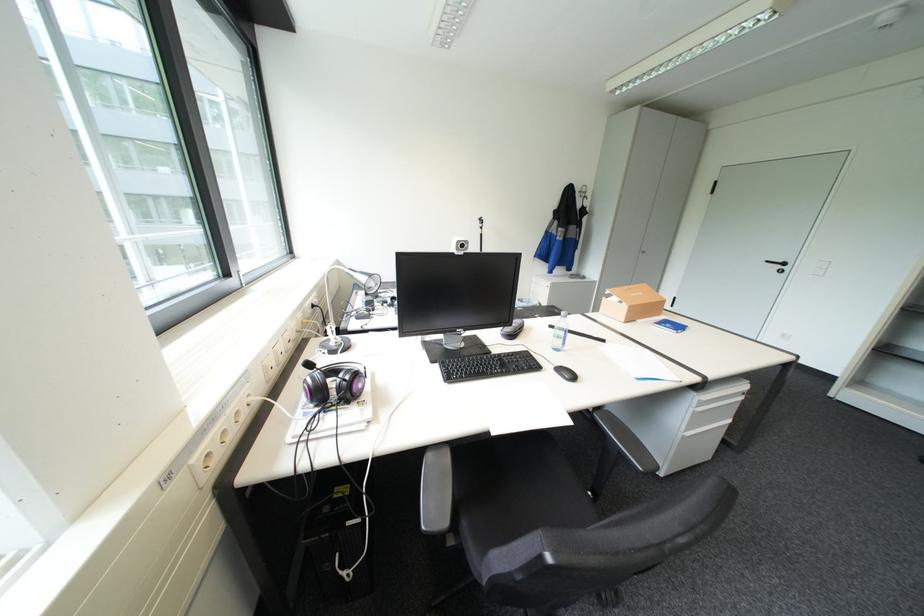
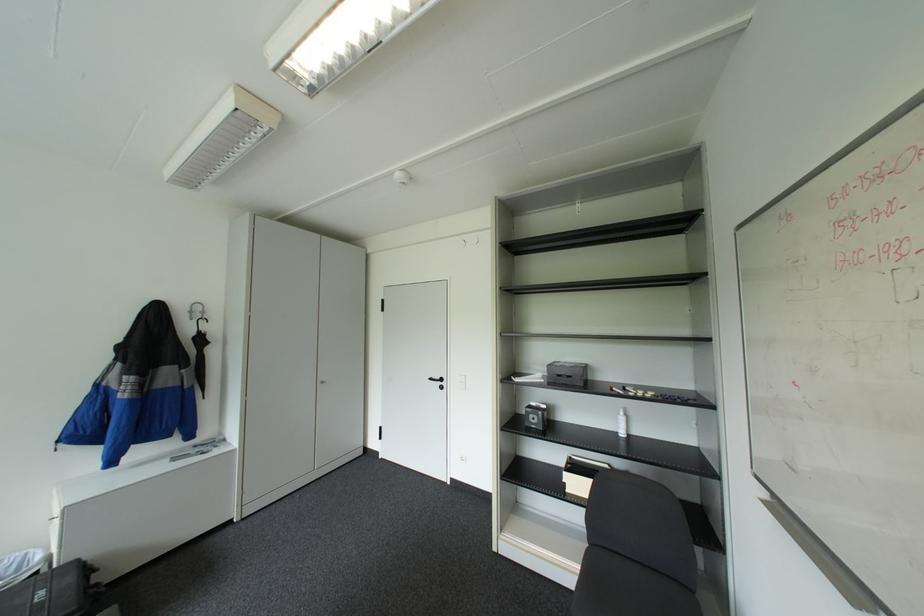
The point at [775,261] is marked in the first image. Where is the corresponding point in the second image?

(439, 378)